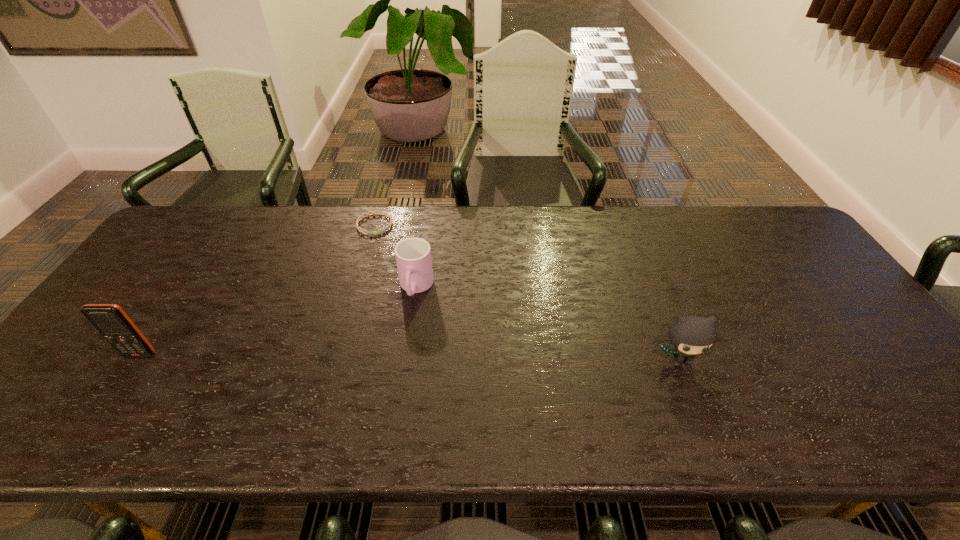
Find the location of a particular element. The height and width of the screenshot is (540, 960). free space between the third tallest object and the leftmost object is located at coordinates (278, 321).

Identify which object is located as the second nearest to the third object from left to right. Please provide its 2D coordinates. Your answer should be formatted as a tuple, i.e. [(x, y)], where the tuple contains the x and y coordinates of a point satisfying the conditions above.

[(691, 335)]

Locate an element on the screen. This screenshot has height=540, width=960. object that is the closest to the cellular telephone is located at coordinates (413, 255).